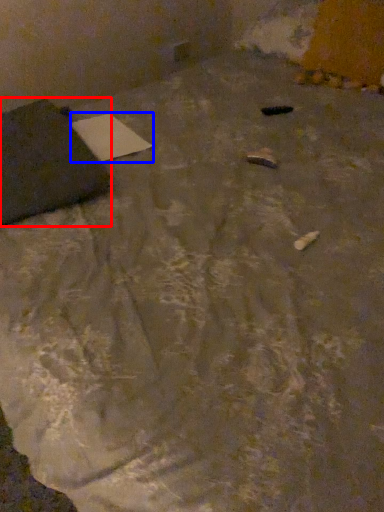
Question: Which of the following is the closest to the observer, furniture (highlighted by a red box) or notepad (highlighted by a blue box)?

Choices:
 (A) furniture
 (B) notepad

Answer: (A)